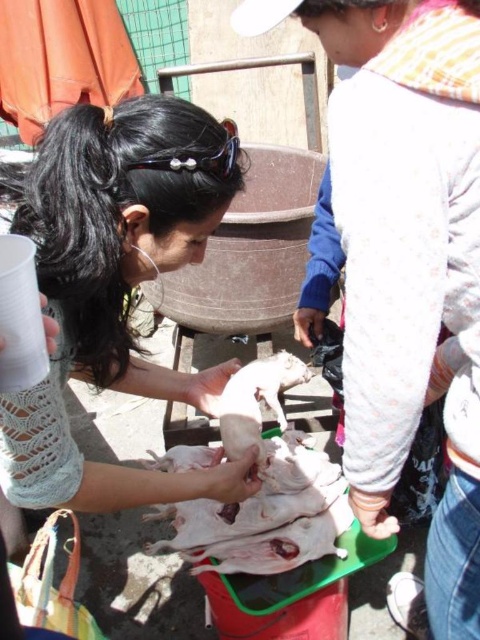
You are a customer at the market and want to buy the white smooth piglet at center. However, you notice the matte white shirt at center is covering part of it. Can you estimate whether the piglet is fully visible underneath the shirt?

The matte white shirt at center is wider than the white smooth piglet at center, so it is likely covering more of the piglet, making parts of it less visible.

What is located at the coordinates point (256, 401) in the image?

The point (256, 401) is on white smooth piglet at center.

You are a customer at the market and want to buy the white smooth piglet at center. The vendor is wearing black plastic goggles at upper center. Where should you look to find the vendor?

The vendor wearing black plastic goggles at upper center is above the white smooth piglet at center, so you should look upward towards the upper center area to find the vendor.